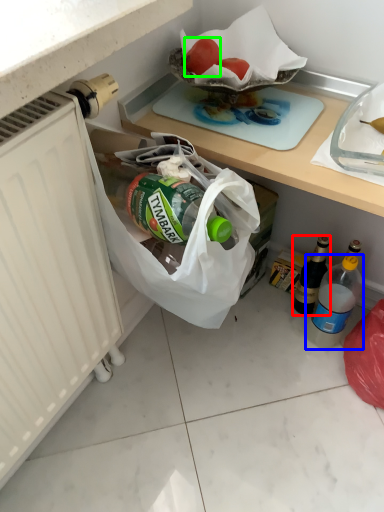
Question: Considering the real-world distances, which object is closest to bottle (highlighted by a red box)? bottle (highlighted by a blue box) or fruit (highlighted by a green box).

Choices:
 (A) bottle
 (B) fruit

Answer: (A)